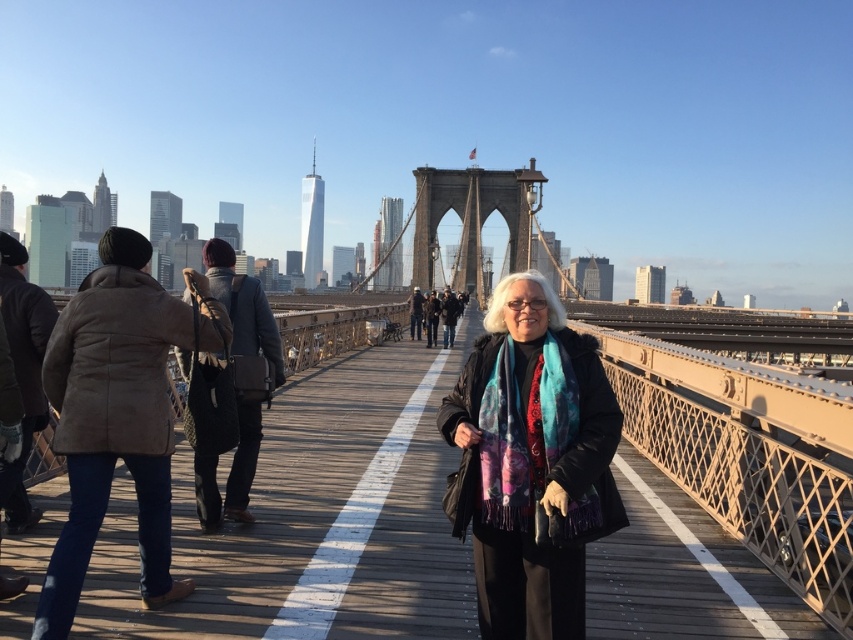
Question: Can you confirm if multicolored scarf at center is thinner than brown fuzzy coat at left?

Choices:
 (A) yes
 (B) no

Answer: (A)

Question: Does multicolored scarf at center have a smaller size compared to brown fuzzy coat at left?

Choices:
 (A) yes
 (B) no

Answer: (A)

Question: Which point is farther to the camera?

Choices:
 (A) multicolored scarf at center
 (B) brown fuzzy coat at left

Answer: (A)

Question: Which of the following is the closest to the observer?

Choices:
 (A) (74, 470)
 (B) (519, 566)

Answer: (A)

Question: Does multicolored scarf at center have a larger size compared to brown fuzzy coat at left?

Choices:
 (A) no
 (B) yes

Answer: (A)